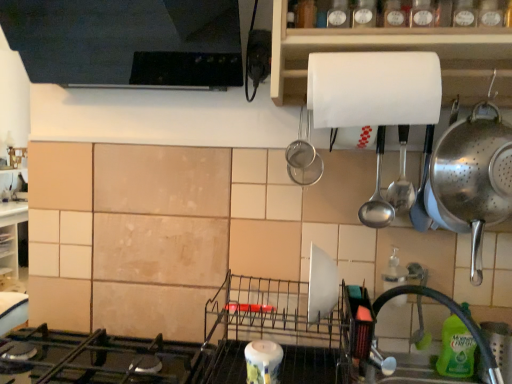
Describe the element at coordinates (472, 177) in the screenshot. I see `polished stainless steel colander at right, arranged as the 1th appliance when viewed from the top` at that location.

Identify the location of green translucent bottle at lower right. Image resolution: width=512 pixels, height=384 pixels. coord(456,350).

What is the approximate height of black matte gas stove at lower left?

3.50 inches.

Where is `black matte gas stove at lower left`? black matte gas stove at lower left is located at coordinates 101,358.

Measure the distance between point (466, 318) and camera.

3.39 feet.

At what (x,y) coordinates should I click in order to perform the action: click on white matte paper towel at upper center. Please return your answer as a coordinate pair (x, y). Looking at the image, I should click on (374, 88).

Can you tell me how much satin silver spoon at upper right and polished stainless steel colander at right, marked as the 2th appliance in a left-to-right arrangement, differ in facing direction?

The angular difference between satin silver spoon at upper right and polished stainless steel colander at right, marked as the 2th appliance in a left-to-right arrangement, is 0.000106 degrees.

Where is `appliance that is the 1st object directly below the satin silver spoon at upper right (from a real-world perspective)`? This screenshot has width=512, height=384. appliance that is the 1st object directly below the satin silver spoon at upper right (from a real-world perspective) is located at coordinates (472, 177).

Would you consider satin silver spoon at upper right to be distant from polished stainless steel colander at right, the first appliance when ordered from right to left?

No, satin silver spoon at upper right is in close proximity to polished stainless steel colander at right, the first appliance when ordered from right to left.

From the picture: Which of these two, satin silver spoon at upper right or polished stainless steel colander at right, arranged as the 1th appliance when viewed from the top, is wider?

With larger width is polished stainless steel colander at right, arranged as the 1th appliance when viewed from the top.

Would you say black matte gas stove at lower left is inside or outside black rubber faucet at lower right?

The correct answer is: outside.

Are black matte gas stove at lower left and black rubber faucet at lower right making contact?

black matte gas stove at lower left and black rubber faucet at lower right are clearly separated.

Is black matte gas stove at lower left facing away from black rubber faucet at lower right?

No, black matte gas stove at lower left's orientation is not away from black rubber faucet at lower right.

Is white matte paper towel at upper center wider or thinner than polished stainless steel colander at right, the first appliance when ordered from right to left?

white matte paper towel at upper center is wider than polished stainless steel colander at right, the first appliance when ordered from right to left.

Considering the relative sizes of white matte paper towel at upper center and polished stainless steel colander at right, arranged as the second appliance when ordered from the bottom, in the image provided, is white matte paper towel at upper center shorter than polished stainless steel colander at right, arranged as the second appliance when ordered from the bottom,?

Yes, white matte paper towel at upper center is shorter than polished stainless steel colander at right, arranged as the second appliance when ordered from the bottom.

Looking at this image, in the image, is white matte paper towel at upper center on the left side or the right side of polished stainless steel colander at right, marked as the 2th appliance in a left-to-right arrangement?

Clearly, white matte paper towel at upper center is on the left of polished stainless steel colander at right, marked as the 2th appliance in a left-to-right arrangement, in the image.

Does white matte paper towel at upper center turn towards polished stainless steel colander at right, the first appliance when ordered from right to left?

No, white matte paper towel at upper center does not turn towards polished stainless steel colander at right, the first appliance when ordered from right to left.

Is green translucent bottle at lower right not near white matte paper towel holder at upper center?

No.

Is point (470, 363) positioned in front of point (445, 105)?

Yes, point (470, 363) is in front of point (445, 105).

From the image's perspective, is green translucent bottle at lower right beneath white matte paper towel holder at upper center?

Yes, from the image's perspective, green translucent bottle at lower right is beneath white matte paper towel holder at upper center.

Between black matte gas stove at lower left and white matte paper towel at upper center, which one is positioned in front?

black matte gas stove at lower left.

Which is more to the right, black matte gas stove at lower left or white matte paper towel at upper center?

Positioned to the right is white matte paper towel at upper center.

From a real-world perspective, is black matte gas stove at lower left positioned over white matte paper towel at upper center based on gravity?

Actually, black matte gas stove at lower left is physically below white matte paper towel at upper center in the real world.

Is black matte gas stove at lower left placed right next to white matte paper towel at upper center?

There is a gap between black matte gas stove at lower left and white matte paper towel at upper center.

From a real-world perspective, is black rubber faucet at lower right physically located above or below white glossy candle at lower center, placed as the 1th appliance when sorted from bottom to top?

From a real-world perspective, black rubber faucet at lower right is physically above white glossy candle at lower center, placed as the 1th appliance when sorted from bottom to top.

Is black rubber faucet at lower right far away from white glossy candle at lower center, placed as the 1th appliance when sorted from bottom to top?

That's not correct — black rubber faucet at lower right is a little close to white glossy candle at lower center, placed as the 1th appliance when sorted from bottom to top.

In terms of height, does black rubber faucet at lower right look taller or shorter compared to white glossy candle at lower center, positioned as the second appliance in top-to-bottom order?

black rubber faucet at lower right is taller than white glossy candle at lower center, positioned as the second appliance in top-to-bottom order.

Does black rubber faucet at lower right turn towards white glossy candle at lower center, placed as the 1th appliance when sorted from bottom to top?

No, black rubber faucet at lower right is not facing towards white glossy candle at lower center, placed as the 1th appliance when sorted from bottom to top.

From the image's perspective, between black rubber faucet at lower right and polished stainless steel colander at right, marked as the 2th appliance in a left-to-right arrangement, which one is located above?

polished stainless steel colander at right, marked as the 2th appliance in a left-to-right arrangement, from the image's perspective.

How different are the orientations of black rubber faucet at lower right and polished stainless steel colander at right, arranged as the second appliance when ordered from the bottom, in degrees?

They differ by 0.000138 degrees in their facing directions.

Who is bigger, black rubber faucet at lower right or polished stainless steel colander at right, the first appliance when ordered from right to left?

With larger size is black rubber faucet at lower right.

In order to click on appliance positioned vertically above the black rubber faucet at lower right (from a real-world perspective) in this screenshot , I will do (472, 177).

In the image, there is a polished stainless steel colander at right, arranged as the second appliance when ordered from the bottom. At what (x,y) coordinates should I click in order to perform the action: click on spoon above it (from the image's perspective). Please return your answer as a coordinate pair (x, y). The height and width of the screenshot is (384, 512). Looking at the image, I should click on (377, 193).

Find the location of a particular element. The height and width of the screenshot is (384, 512). gas stove below the black rubber faucet at lower right (from a real-world perspective) is located at coordinates (101, 358).

From the image, which object appears to be farther from black rubber faucet at lower right, white glossy candle at lower center, placed as the 1th appliance when sorted from bottom to top, or green translucent bottle at lower right?

The object further to black rubber faucet at lower right is white glossy candle at lower center, placed as the 1th appliance when sorted from bottom to top.

Which object lies further to the anchor point white glossy candle at lower center, the 1th appliance in the left-to-right sequence, green translucent bottle at lower right or black matte gas stove at lower left?

The object further to white glossy candle at lower center, the 1th appliance in the left-to-right sequence, is green translucent bottle at lower right.

Consider the image. Which object lies further to the anchor point black rubber faucet at lower right, polished stainless steel colander at right, arranged as the 1th appliance when viewed from the top, or white matte paper towel at upper center?

white matte paper towel at upper center is positioned further to the anchor black rubber faucet at lower right.

Based on their spatial positions, is polished stainless steel colander at right, marked as the 2th appliance in a left-to-right arrangement, or green translucent bottle at lower right further from white matte paper towel holder at upper center?

The object further to white matte paper towel holder at upper center is green translucent bottle at lower right.

Which object lies nearer to the anchor point white glossy candle at lower center, placed as the 1th appliance when sorted from bottom to top, black rubber faucet at lower right or black matte gas stove at lower left?

black matte gas stove at lower left is closer to white glossy candle at lower center, placed as the 1th appliance when sorted from bottom to top.

Considering their positions, is white glossy candle at lower center, the second appliance in the right-to-left sequence, positioned further to satin silver spoon at upper right than black matte gas stove at lower left?

black matte gas stove at lower left lies further to satin silver spoon at upper right than the other object.

Which object lies nearer to the anchor point green translucent bottle at lower right, satin silver spoon at upper right or polished stainless steel colander at right, marked as the 2th appliance in a left-to-right arrangement?

polished stainless steel colander at right, marked as the 2th appliance in a left-to-right arrangement, is closer to green translucent bottle at lower right.

When comparing their distances from green translucent bottle at lower right, does black rubber faucet at lower right or black matte gas stove at lower left seem further?

Among the two, black matte gas stove at lower left is located further to green translucent bottle at lower right.

Where is `appliance between satin silver spoon at upper right and green translucent bottle at lower right from top to bottom`? Image resolution: width=512 pixels, height=384 pixels. appliance between satin silver spoon at upper right and green translucent bottle at lower right from top to bottom is located at coordinates (472, 177).

You are a GUI agent. You are given a task and a screenshot of the screen. Output one action in this format:
    pyautogui.click(x=<x>, y=<y>)
    Task: Click on the paper towel between white matte paper towel holder at upper center and polished stainless steel colander at right, arranged as the second appliance when ordered from the bottom, from top to bottom
    
    Given the screenshot: What is the action you would take?
    pyautogui.click(x=374, y=88)

Find the location of a particular element. The height and width of the screenshot is (384, 512). paper towel between black matte gas stove at lower left and polished stainless steel colander at right, arranged as the 1th appliance when viewed from the top, in the horizontal direction is located at coordinates (374, 88).

At what (x,y) coordinates should I click in order to perform the action: click on paper towel between white matte paper towel holder at upper center and black rubber faucet at lower right from top to bottom. Please return your answer as a coordinate pair (x, y). The image size is (512, 384). Looking at the image, I should click on (374, 88).